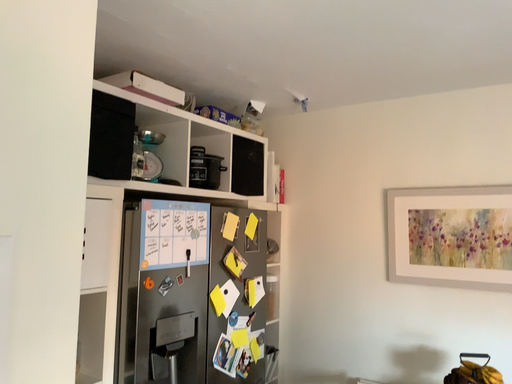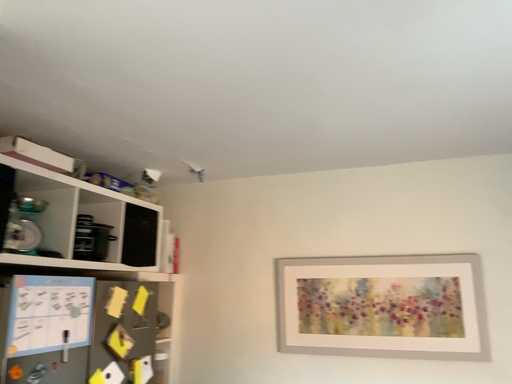
Question: Which way did the camera rotate in the video?

Choices:
 (A) rotated left
 (B) rotated right

Answer: (B)